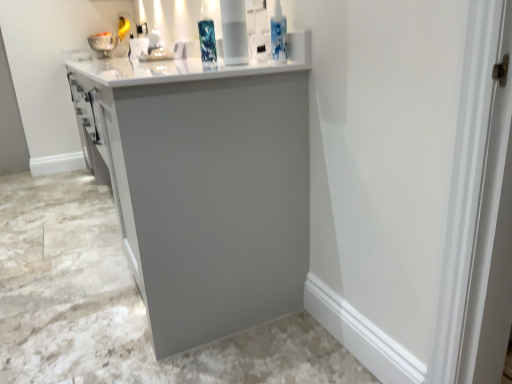
Question: In terms of height, does matte gray cabinet at center look taller or shorter compared to white glossy vase at upper center?

Choices:
 (A) short
 (B) tall

Answer: (B)

Question: Is point (234, 218) positioned closer to the camera than point (228, 61)?

Choices:
 (A) farther
 (B) closer

Answer: (B)

Question: Which of these objects is positioned farthest from the white glossy sink at upper center?

Choices:
 (A) matte gray cabinet at center
 (B) white glossy vase at upper center

Answer: (A)

Question: Estimate the real-world distances between objects in this image. Which object is farther from the matte gray cabinet at center?

Choices:
 (A) white glossy vase at upper center
 (B) white glossy sink at upper center

Answer: (B)